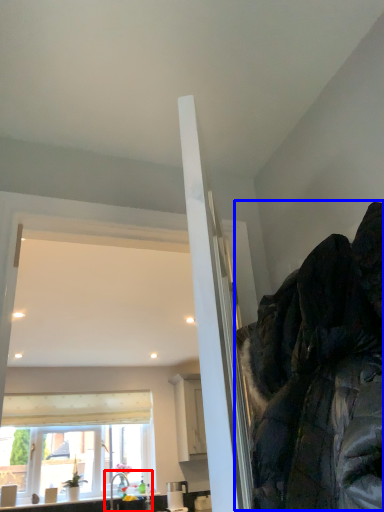
Question: Which of the following is the closest to the observer, sink (highlighted by a red box) or jacket (highlighted by a blue box)?

Choices:
 (A) sink
 (B) jacket

Answer: (B)